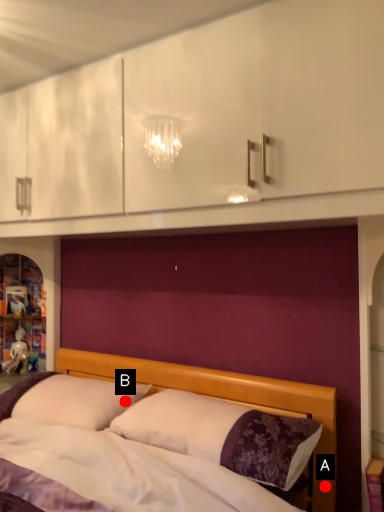
Question: Two points are circled on the image, labeled by A and B beside each circle. Which point is closer to the camera taking this photo?

Choices:
 (A) A is closer
 (B) B is closer

Answer: (A)